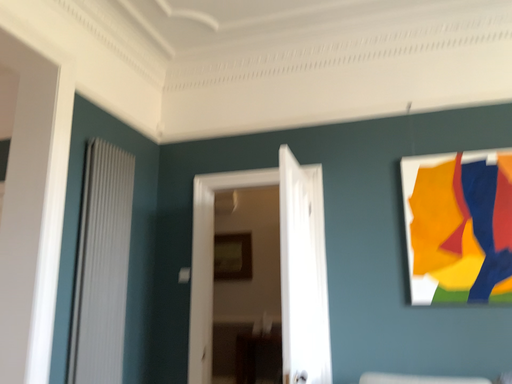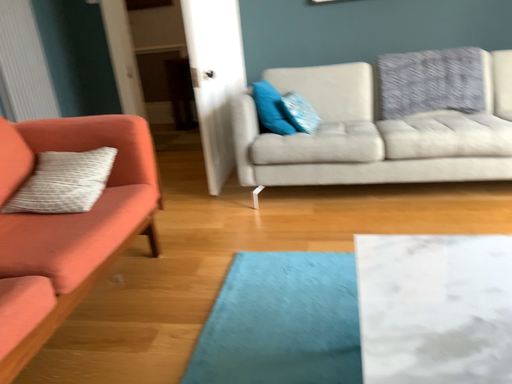
Question: How did the camera likely rotate when shooting the video?

Choices:
 (A) rotated downward
 (B) rotated upward

Answer: (A)